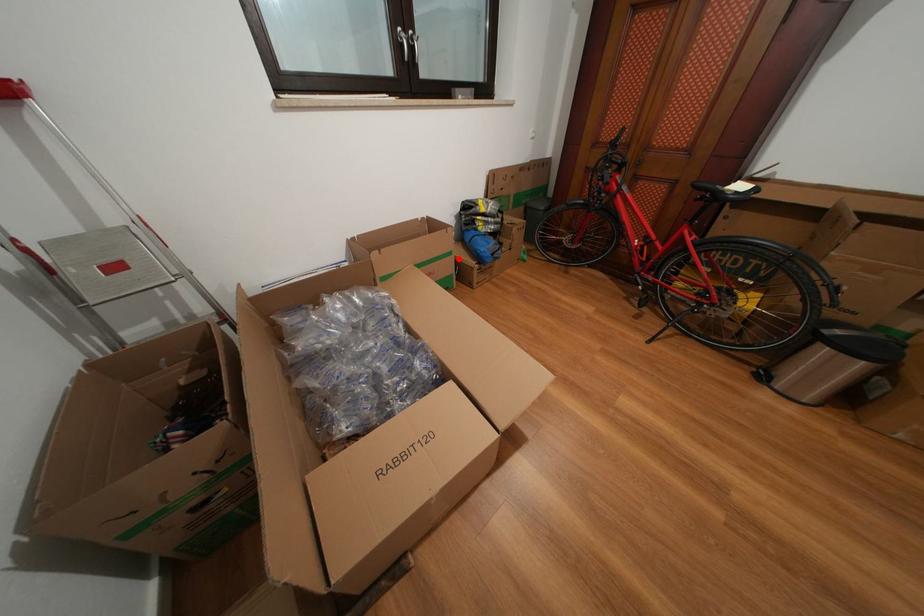
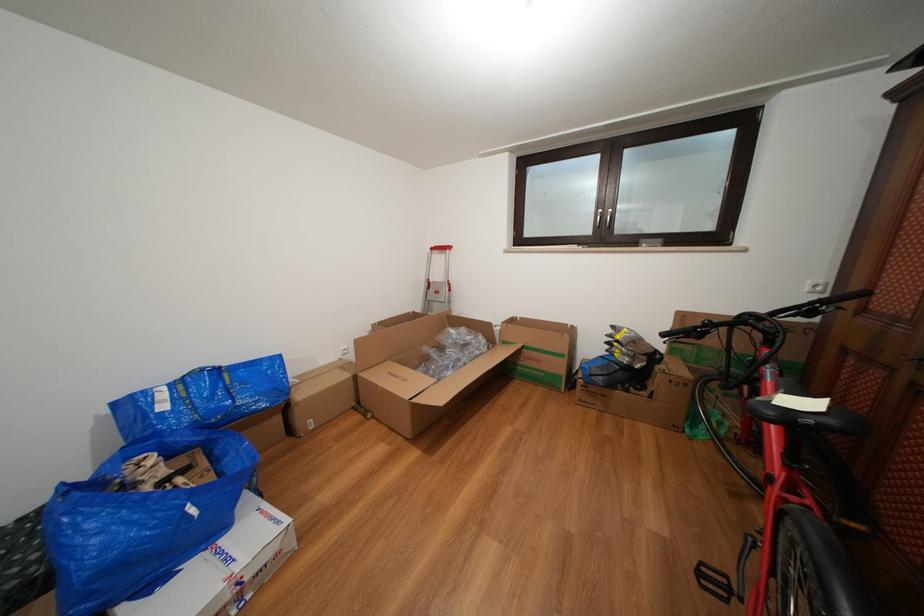
Question: I am providing you with two images of the same scene from different viewpoints. Image1 has a red point marked. In image2, the corresponding 3D location appears at what relative position? Reply with the corresponding letter.

Choices:
 (A) Closer
 (B) Farther

Answer: (B)